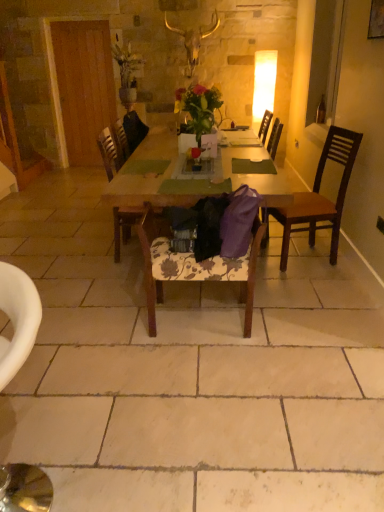
Image resolution: width=384 pixels, height=512 pixels. I want to click on matte yellow lampshade at upper right, so click(263, 85).

Locate an element on the screen. The height and width of the screenshot is (512, 384). wooden picture frame at upper right is located at coordinates (376, 20).

What do you see at coordinates (187, 180) in the screenshot? I see `wooden table at center` at bounding box center [187, 180].

The image size is (384, 512). I want to click on white floral fabric chair at lower left, acting as the 1th chair starting from the front, so click(17, 319).

How many degrees apart are the facing directions of wooden chair at center, placed as the 1th chair when sorted from back to front, and wooden table at center?

90.5 degrees.

You are a GUI agent. You are given a task and a screenshot of the screen. Output one action in this format:
    pyautogui.click(x=<x>, y=<y>)
    Task: Click on the desk on the right of wooden chair at center, arranged as the second chair when viewed from the left
    
    Given the screenshot: What is the action you would take?
    pyautogui.click(x=187, y=180)

From the image's perspective, is wooden chair at center, arranged as the second chair when viewed from the left, over wooden table at center?

Actually, wooden chair at center, arranged as the second chair when viewed from the left, appears below wooden table at center in the image.

Does wooden chair at center, placed as the 1th chair when sorted from back to front, have a smaller size compared to wooden table at center?

Correct, wooden chair at center, placed as the 1th chair when sorted from back to front, occupies less space than wooden table at center.

Choose the correct answer: Is floral fabric chair at center, the second chair viewed from the right, inside vibrant floral bouquet at center or outside it?

floral fabric chair at center, the second chair viewed from the right, lies outside vibrant floral bouquet at center.

Is point (264, 225) closer or farther from the camera than point (216, 96)?

Point (264, 225) is positioned closer to the camera compared to point (216, 96).

From a real-world perspective, is floral fabric chair at center, arranged as the second chair when viewed from the front, positioned under vibrant floral bouquet at center based on gravity?

Indeed, from a real-world perspective, floral fabric chair at center, arranged as the second chair when viewed from the front, is positioned beneath vibrant floral bouquet at center.

Can you confirm if floral fabric chair at center, which is the 3th chair in back-to-front order, is thinner than vibrant floral bouquet at center?

Yes, floral fabric chair at center, which is the 3th chair in back-to-front order, is thinner than vibrant floral bouquet at center.

Are floral fabric chair at center, arranged as the second chair when viewed from the front, and white floral fabric chair at lower left, the fourth chair viewed from the right, making contact?

floral fabric chair at center, arranged as the second chair when viewed from the front, and white floral fabric chair at lower left, the fourth chair viewed from the right, are not in contact.

Is floral fabric chair at center, which is the 3th chair in back-to-front order, smaller than white floral fabric chair at lower left, the fourth chair viewed from the right?

Actually, floral fabric chair at center, which is the 3th chair in back-to-front order, might be larger than white floral fabric chair at lower left, the fourth chair viewed from the right.

Which chair is the 2nd one when counting from the right side of the white floral fabric chair at lower left, the fourth chair viewed from the right? Please provide its 2D coordinates.

[(194, 267)]

Considering the relative positions of floral fabric chair at center, arranged as the second chair when viewed from the front, and white floral fabric chair at lower left, the fourth chair viewed from the right, in the image provided, is floral fabric chair at center, arranged as the second chair when viewed from the front, to the right of white floral fabric chair at lower left, the fourth chair viewed from the right, from the viewer's perspective?

Indeed, floral fabric chair at center, arranged as the second chair when viewed from the front, is positioned on the right side of white floral fabric chair at lower left, the fourth chair viewed from the right.

Is matte yellow lampshade at upper right at the back of wooden chair at center, positioned as the 4th chair in front-to-back order?

No.

Considering the sizes of objects wooden chair at center, arranged as the second chair when viewed from the left, and matte yellow lampshade at upper right in the image provided, who is smaller, wooden chair at center, arranged as the second chair when viewed from the left, or matte yellow lampshade at upper right?

matte yellow lampshade at upper right is smaller.

How different are the orientations of wooden chair at center, arranged as the second chair when viewed from the left, and matte yellow lampshade at upper right in degrees?

They differ by 88.7 degrees in their facing directions.

Does wooden chair at center, arranged as the second chair when viewed from the left, touch matte yellow lampshade at upper right?

No, wooden chair at center, arranged as the second chair when viewed from the left, is not making contact with matte yellow lampshade at upper right.

Choose the correct answer: Is wooden picture frame at upper right inside brown wooden chair at right, which is the second chair from back to front, or outside it?

wooden picture frame at upper right is located beyond the bounds of brown wooden chair at right, which is the second chair from back to front.

Who is smaller, wooden picture frame at upper right or brown wooden chair at right, positioned as the third chair in front-to-back order?

Smaller between the two is wooden picture frame at upper right.

Is wooden picture frame at upper right next to brown wooden chair at right, which is the fourth chair from left to right, and touching it?

wooden picture frame at upper right and brown wooden chair at right, which is the fourth chair from left to right, are clearly separated.

Which is more to the right, wooden picture frame at upper right or brown wooden chair at right, positioned as the third chair in front-to-back order?

wooden picture frame at upper right.

Can you tell me how much brown wooden chair at right, which is the second chair from back to front, and vibrant floral bouquet at center differ in facing direction?

The facing directions of brown wooden chair at right, which is the second chair from back to front, and vibrant floral bouquet at center are 79.3 degrees apart.

Considering the positions of objects brown wooden chair at right, which is the first chair in right-to-left order, and vibrant floral bouquet at center in the image provided, who is more to the left, brown wooden chair at right, which is the first chair in right-to-left order, or vibrant floral bouquet at center?

From the viewer's perspective, vibrant floral bouquet at center appears more on the left side.

Considering the sizes of brown wooden chair at right, which is the fourth chair from left to right, and vibrant floral bouquet at center in the image, is brown wooden chair at right, which is the fourth chair from left to right, wider or thinner than vibrant floral bouquet at center?

In the image, brown wooden chair at right, which is the fourth chair from left to right, appears to be wider than vibrant floral bouquet at center.

How many degrees apart are the facing directions of white floral fabric chair at lower left, the fourth chair viewed from the back, and wooden chair at center, positioned as the 4th chair in front-to-back order?

There is a 95.8-degree angle between the facing directions of white floral fabric chair at lower left, the fourth chair viewed from the back, and wooden chair at center, positioned as the 4th chair in front-to-back order.

Image resolution: width=384 pixels, height=512 pixels. I want to click on the 1st chair directly above the white floral fabric chair at lower left, the fourth chair viewed from the back (from a real-world perspective), so click(112, 149).

Is white floral fabric chair at lower left, the fourth chair viewed from the right, positioned far away from wooden chair at center, placed as the 1th chair when sorted from back to front?

Yes, white floral fabric chair at lower left, the fourth chair viewed from the right, and wooden chair at center, placed as the 1th chair when sorted from back to front, are quite far apart.

Between white floral fabric chair at lower left, the first chair positioned from the left, and wooden chair at center, positioned as the third chair in right-to-left order, which one appears on the left side from the viewer's perspective?

white floral fabric chair at lower left, the first chair positioned from the left, is more to the left.

Find the location of a particular element. Image resolution: width=384 pixels, height=512 pixels. desk in front of the wooden chair at center, positioned as the 4th chair in front-to-back order is located at coordinates (187, 180).

In order to click on the 3rd chair positioned below the vibrant floral bouquet at center (from the image's perspective) in this screenshot , I will do `click(194, 267)`.

From the image, which object appears to be nearer to wooden picture frame at upper right, matte yellow lampshade at upper right or wooden chair at center, arranged as the second chair when viewed from the left?

wooden chair at center, arranged as the second chair when viewed from the left.

Looking at the image, which one is located further to floral fabric chair at center, which is the 3th chair in back-to-front order, matte yellow lampshade at upper right or wooden chair at center, placed as the 1th chair when sorted from back to front?

Based on the image, matte yellow lampshade at upper right appears to be further to floral fabric chair at center, which is the 3th chair in back-to-front order.

In the scene shown: From the image, which object appears to be farther from wooden table at center, matte yellow lampshade at upper right or white floral fabric chair at lower left, acting as the 1th chair starting from the front?

Among the two, matte yellow lampshade at upper right is located further to wooden table at center.

When comparing their distances from brown wooden chair at right, which is the second chair from back to front, does wooden chair at center, positioned as the 4th chair in front-to-back order, or wooden table at center seem closer?

Among the two, wooden table at center is located nearer to brown wooden chair at right, which is the second chair from back to front.

From the picture: When comparing their distances from wooden chair at center, arranged as the second chair when viewed from the left, does wooden picture frame at upper right or matte yellow lampshade at upper right seem closer?

The object closer to wooden chair at center, arranged as the second chair when viewed from the left, is wooden picture frame at upper right.

Which object lies further to the anchor point wooden chair at center, arranged as the second chair when viewed from the left, white floral fabric chair at lower left, the fourth chair viewed from the right, or matte yellow lampshade at upper right?

matte yellow lampshade at upper right is positioned further to the anchor wooden chair at center, arranged as the second chair when viewed from the left.

When comparing their distances from wooden table at center, does brown wooden chair at right, positioned as the third chair in front-to-back order, or floral fabric chair at center, arranged as the second chair when viewed from the front, seem closer?

The object closer to wooden table at center is brown wooden chair at right, positioned as the third chair in front-to-back order.

Which object lies nearer to the anchor point wooden picture frame at upper right, vibrant floral bouquet at center or floral fabric chair at center, the second chair viewed from the right?

Based on the image, vibrant floral bouquet at center appears to be nearer to wooden picture frame at upper right.

Locate an element on the screen. The height and width of the screenshot is (512, 384). flower between wooden chair at center, positioned as the 4th chair in front-to-back order, and matte yellow lampshade at upper right from front to back is located at coordinates (198, 106).

This screenshot has height=512, width=384. What are the coordinates of `desk between white floral fabric chair at lower left, acting as the 1th chair starting from the front, and matte yellow lampshade at upper right in the front-back direction` in the screenshot? It's located at (187, 180).

Image resolution: width=384 pixels, height=512 pixels. In order to click on picture frame located between white floral fabric chair at lower left, acting as the 1th chair starting from the front, and vibrant floral bouquet at center in the depth direction in this screenshot , I will do `click(376, 20)`.

Where is `desk between floral fabric chair at center, arranged as the third chair when viewed from the left, and matte yellow lampshade at upper right from front to back`? Image resolution: width=384 pixels, height=512 pixels. desk between floral fabric chair at center, arranged as the third chair when viewed from the left, and matte yellow lampshade at upper right from front to back is located at coordinates (187, 180).